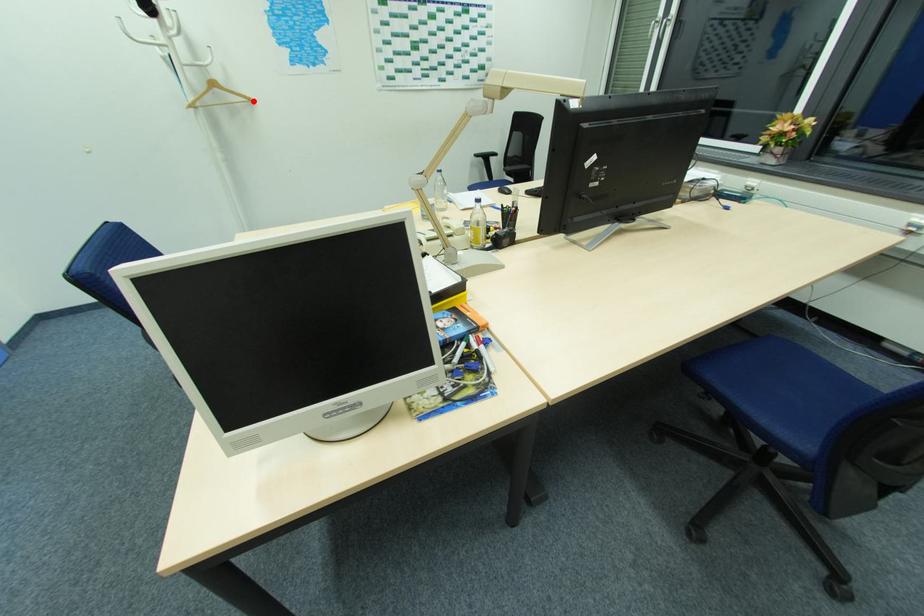
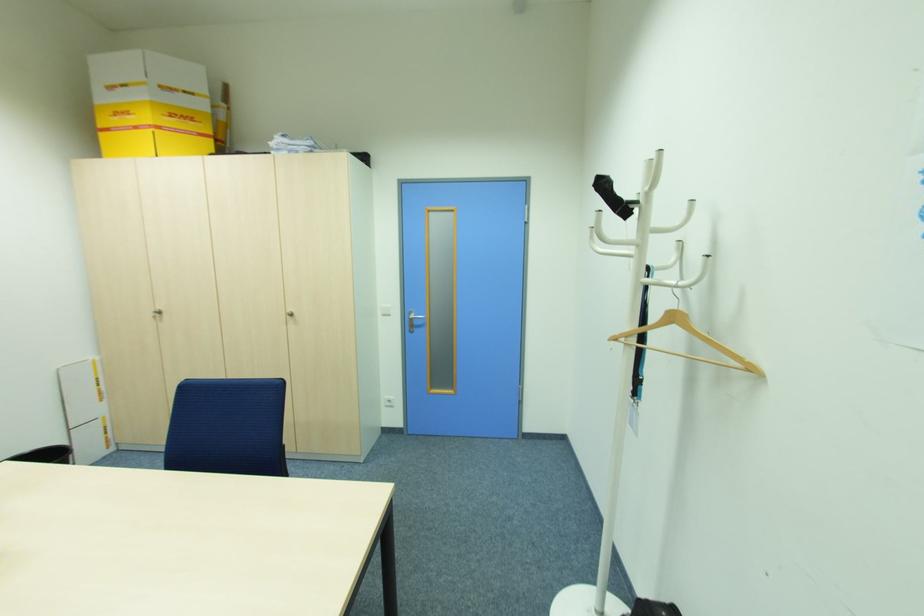
Where in the second image is the point corresponding to the highlighted location from the first image?

(756, 370)